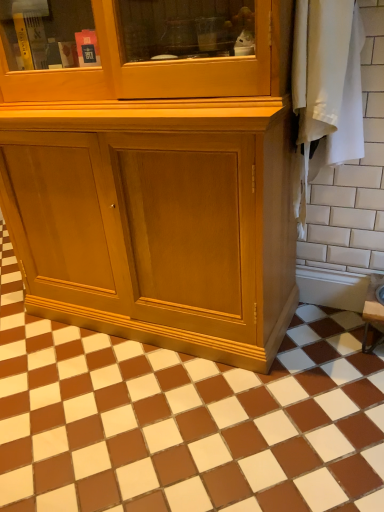
Question: Can you confirm if white ceramic tile at right, which is the second ceramic tile from left to right, is positioned to the right of brown glossy tile at center, the first ceramic tile positioned from the bottom?

Choices:
 (A) yes
 (B) no

Answer: (A)

Question: Is white ceramic tile at right, which is the second ceramic tile in bottom-to-top order, facing towards brown glossy tile at center, the 1th ceramic tile positioned from the left?

Choices:
 (A) yes
 (B) no

Answer: (B)

Question: From the image's perspective, is white ceramic tile at right, which is the second ceramic tile from left to right, below brown glossy tile at center, which appears as the second ceramic tile when viewed from the top?

Choices:
 (A) yes
 (B) no

Answer: (B)

Question: Is white ceramic tile at right, which is the second ceramic tile in bottom-to-top order, looking in the opposite direction of brown glossy tile at center, the 1th ceramic tile positioned from the left?

Choices:
 (A) no
 (B) yes

Answer: (A)

Question: From a real-world perspective, is white ceramic tile at right, acting as the 1th ceramic tile starting from the top, physically below brown glossy tile at center, the second ceramic tile in the right-to-left sequence?

Choices:
 (A) no
 (B) yes

Answer: (A)

Question: Does brown glossy tile at center, which appears as the second ceramic tile when viewed from the top, have a lesser height compared to white ceramic tile at right, which is the second ceramic tile in bottom-to-top order?

Choices:
 (A) no
 (B) yes

Answer: (B)

Question: Is the depth of brown glossy tile at center, the first ceramic tile positioned from the bottom, greater than that of white ceramic tile at right, acting as the 1th ceramic tile starting from the top?

Choices:
 (A) no
 (B) yes

Answer: (A)

Question: Can you confirm if brown glossy tile at center, which appears as the second ceramic tile when viewed from the top, is smaller than white ceramic tile at right, which is the second ceramic tile in bottom-to-top order?

Choices:
 (A) no
 (B) yes

Answer: (A)

Question: Does brown glossy tile at center, the second ceramic tile in the right-to-left sequence, appear on the right side of white ceramic tile at right, which is the second ceramic tile in bottom-to-top order?

Choices:
 (A) yes
 (B) no

Answer: (B)

Question: Is brown glossy tile at center, which appears as the second ceramic tile when viewed from the top, not within white ceramic tile at right, which is the second ceramic tile in bottom-to-top order?

Choices:
 (A) no
 (B) yes

Answer: (B)

Question: Is brown glossy tile at center, which appears as the second ceramic tile when viewed from the top, looking in the opposite direction of white ceramic tile at right, which is the second ceramic tile from left to right?

Choices:
 (A) no
 (B) yes

Answer: (A)

Question: From the image's perspective, is brown glossy tile at center, the second ceramic tile in the right-to-left sequence, positioned above or below white ceramic tile at right, the 1th ceramic tile viewed from the right?

Choices:
 (A) above
 (B) below

Answer: (B)